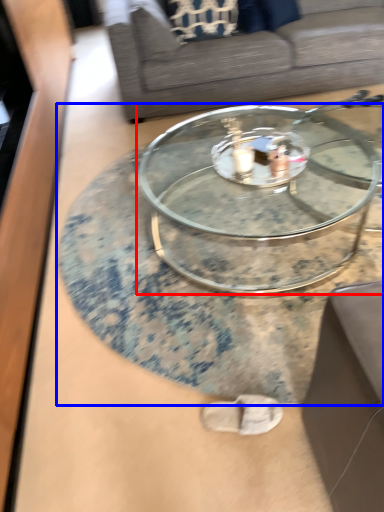
Question: Which of the following is the farthest to the observer, coffee table (highlighted by a red box) or coffee table (highlighted by a blue box)?

Choices:
 (A) coffee table
 (B) coffee table

Answer: (A)